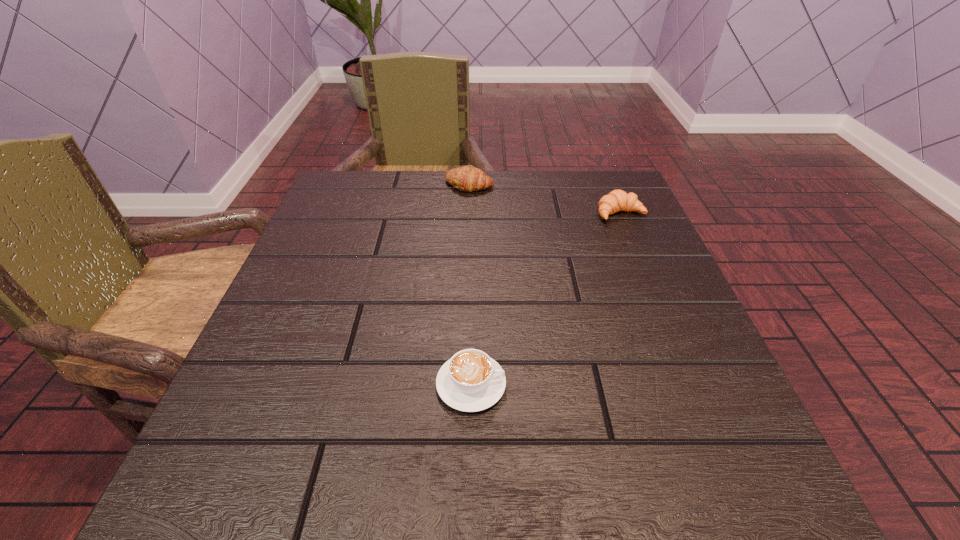
Where is `vacant region between the rightmost object and the cappuccino`? The width and height of the screenshot is (960, 540). vacant region between the rightmost object and the cappuccino is located at coordinates (545, 299).

Find the location of a particular element. Image resolution: width=960 pixels, height=540 pixels. free space between the left crescent roll and the cappuccino is located at coordinates (470, 285).

Where is `vacant point located between the right crescent roll and the nearest object`? This screenshot has height=540, width=960. vacant point located between the right crescent roll and the nearest object is located at coordinates (545, 299).

The height and width of the screenshot is (540, 960). What are the coordinates of `free point between the second farthest object and the nearest object` in the screenshot? It's located at (545, 299).

This screenshot has width=960, height=540. Find the location of `free spot between the right crescent roll and the left crescent roll`. free spot between the right crescent roll and the left crescent roll is located at coordinates click(x=545, y=199).

Locate an element on the screen. Image resolution: width=960 pixels, height=540 pixels. blank region between the right crescent roll and the farther crescent roll is located at coordinates (545, 199).

Find the location of a particular element. This screenshot has width=960, height=540. unoccupied position between the cappuccino and the nearer crescent roll is located at coordinates (545, 299).

The height and width of the screenshot is (540, 960). What are the coordinates of `vacant space that is in between the right crescent roll and the nearest object` in the screenshot? It's located at (545, 299).

This screenshot has width=960, height=540. What are the coordinates of `the second closest object to the cappuccino` in the screenshot? It's located at (468, 178).

Image resolution: width=960 pixels, height=540 pixels. In order to click on object that is the second closest to the nearest object in this screenshot , I will do `click(468, 178)`.